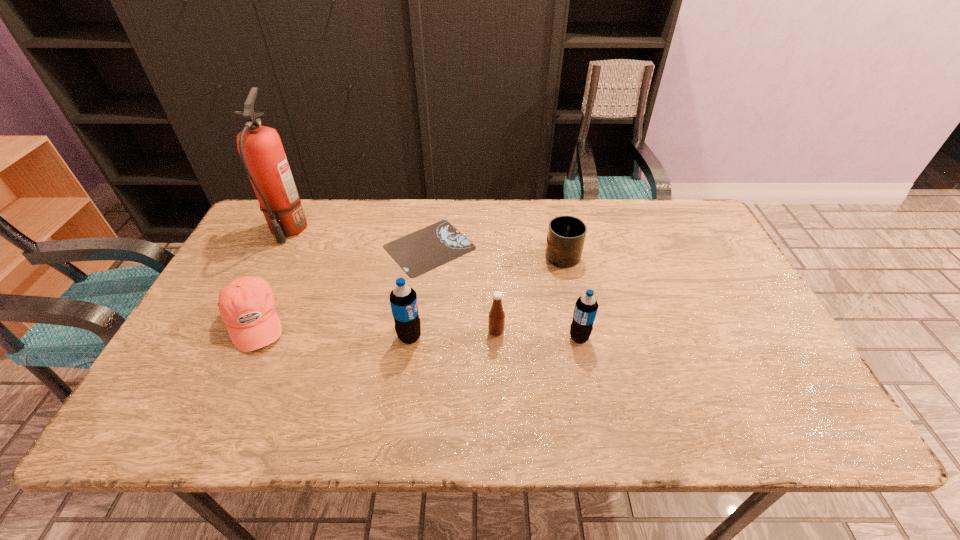
Locate an element on the screen. The width and height of the screenshot is (960, 540). mousepad that is at the far edge is located at coordinates pyautogui.click(x=419, y=252).

Image resolution: width=960 pixels, height=540 pixels. I want to click on fire extinguisher that is at the left edge, so (x=260, y=147).

Where is `baseball cap present at the left edge`? baseball cap present at the left edge is located at coordinates (247, 305).

This screenshot has height=540, width=960. Find the location of `object present at the far left corner`. object present at the far left corner is located at coordinates (260, 147).

This screenshot has height=540, width=960. In the image, there is a desktop. Identify the location of vacant area at the far edge. (535, 214).

Find the location of `free space at the near edge of the desktop`. free space at the near edge of the desktop is located at coordinates (598, 378).

The width and height of the screenshot is (960, 540). Identify the location of vacant space at the left edge. (233, 359).

Find the location of a particular element. This screenshot has height=540, width=960. free space at the right edge of the desktop is located at coordinates 706,313.

Identify the location of free space at the far right corner of the desktop. (670, 204).

This screenshot has width=960, height=540. In the image, there is a desktop. Identify the location of vacant space at the near right corner. (740, 368).